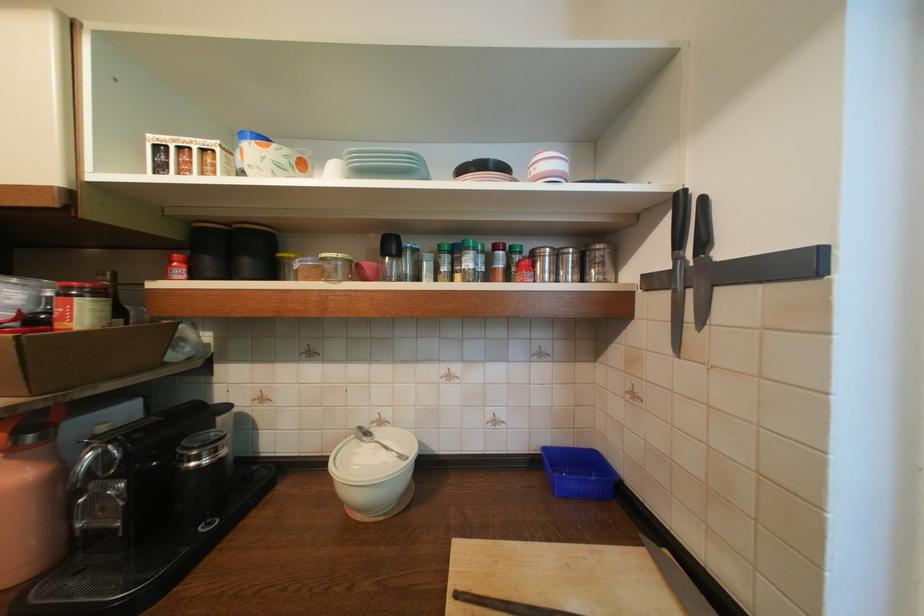
What are the coordinates of `coffee machine lever` in the screenshot? It's located at (159, 430).